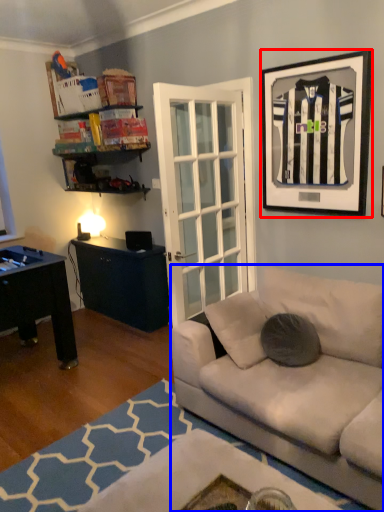
Question: Among these objects, which one is farthest to the camera, picture frame (highlighted by a red box) or studio couch (highlighted by a blue box)?

Choices:
 (A) picture frame
 (B) studio couch

Answer: (A)